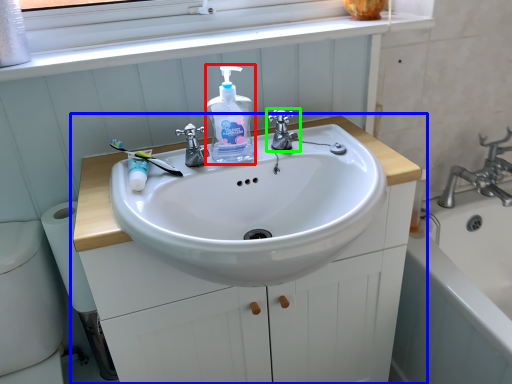
Question: Which object is the closest to the cleaning product (highlighted by a red box)? Choose among these: bathroom cabinet (highlighted by a blue box) or tap (highlighted by a green box).

Choices:
 (A) bathroom cabinet
 (B) tap

Answer: (B)